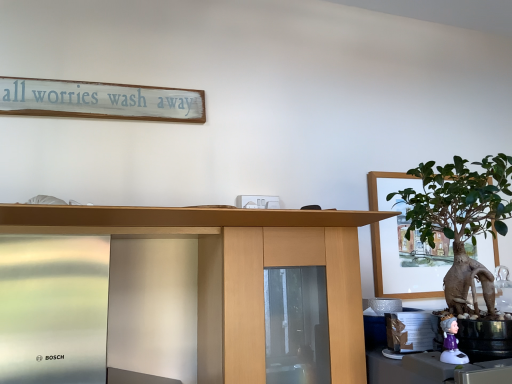
What do you see at coordinates (462, 220) in the screenshot? I see `green matte houseplant at right` at bounding box center [462, 220].

This screenshot has width=512, height=384. I want to click on white plastic figurine at lower right, so click(451, 343).

Does point (457, 345) appear closer or farther from the camera than point (477, 207)?

Point (457, 345).

From the image's perspective, is white plastic figurine at lower right over green matte houseplant at right?

No.

Is white plastic figurine at lower right at the right side of green matte houseplant at right?

No.

Consider the image. Which of these two, white plastic figurine at lower right or green matte houseplant at right, stands taller?

Standing taller between the two is green matte houseplant at right.

Who is more distant, green matte houseplant at right or white painted wood signboard at upper center?

white painted wood signboard at upper center is more distant.

From the picture: From a real-world perspective, is green matte houseplant at right located beneath white painted wood signboard at upper center?

Indeed, from a real-world perspective, green matte houseplant at right is positioned beneath white painted wood signboard at upper center.

Which is behind, point (467, 232) or point (14, 88)?

The point (14, 88) is behind.

Is green matte houseplant at right oriented away from white painted wood signboard at upper center?

green matte houseplant at right is not turned away from white painted wood signboard at upper center.

How different are the orientations of white painted wood signboard at upper center and green matte houseplant at right in degrees?

They differ by 0.498 degrees in their facing directions.

Considering the sizes of white painted wood signboard at upper center and green matte houseplant at right in the image, is white painted wood signboard at upper center wider or thinner than green matte houseplant at right?

Considering their sizes, white painted wood signboard at upper center looks slimmer than green matte houseplant at right.

At what (x,y) coordinates should I click in order to perform the action: click on houseplant below the white painted wood signboard at upper center (from the image's perspective). Please return your answer as a coordinate pair (x, y). This screenshot has width=512, height=384. Looking at the image, I should click on (462, 220).

In order to click on desk on the left of the white plastic figurine at lower right in this screenshot , I will do `click(237, 272)`.

Can you confirm if wooden desk at center is shorter than white plastic figurine at lower right?

In fact, wooden desk at center may be taller than white plastic figurine at lower right.

From the image's perspective, which is below, wooden desk at center or white plastic figurine at lower right?

white plastic figurine at lower right, from the image's perspective.

From the picture: Considering the relative positions of wooden desk at center and white plastic figurine at lower right in the image provided, is wooden desk at center to the right of white plastic figurine at lower right from the viewer's perspective?

In fact, wooden desk at center is to the left of white plastic figurine at lower right.

From the image's perspective, is green matte houseplant at right above or below white plastic figurine at lower right?

From the image's perspective, green matte houseplant at right appears above white plastic figurine at lower right.

Does green matte houseplant at right appear on the right side of white plastic figurine at lower right?

Correct, you'll find green matte houseplant at right to the right of white plastic figurine at lower right.

Image resolution: width=512 pixels, height=384 pixels. I want to click on toy that is behind the green matte houseplant at right, so click(x=451, y=343).

Considering the positions of point (448, 181) and point (455, 356), is point (448, 181) closer or farther from the camera than point (455, 356)?

Point (448, 181).

Is green matte houseplant at right closer to camera compared to wooden desk at center?

No, the depth of green matte houseplant at right is greater than that of wooden desk at center.

Which is closer to the camera, [450,204] or [317,243]?

The point [450,204] is in front.

Does green matte houseplant at right have a lesser height compared to wooden desk at center?

Correct, green matte houseplant at right is not as tall as wooden desk at center.

How different are the orientations of wooden desk at center and white painted wood signboard at upper center in degrees?

wooden desk at center and white painted wood signboard at upper center are facing 0.498 degrees away from each other.

Is point (92, 215) farther from camera compared to point (138, 98)?

No.

In the scene shown: From the image's perspective, between wooden desk at center and white painted wood signboard at upper center, who is located below?

wooden desk at center is shown below in the image.

Is wooden desk at center not near white painted wood signboard at upper center?

No.

Locate an element on the screen. houseplant above the white plastic figurine at lower right (from the image's perspective) is located at coordinates (462, 220).

This screenshot has width=512, height=384. Find the location of `bulletin board that is above the green matte houseplant at right (from a real-world perspective)`. bulletin board that is above the green matte houseplant at right (from a real-world perspective) is located at coordinates (99, 100).

When comparing their distances from wooden desk at center, does green matte houseplant at right or white plastic figurine at lower right seem further?

white plastic figurine at lower right is further to wooden desk at center.

Which object lies further to the anchor point green matte houseplant at right, white plastic figurine at lower right or wooden desk at center?

Based on the image, wooden desk at center appears to be further to green matte houseplant at right.

Looking at the image, which one is located closer to wooden desk at center, white painted wood signboard at upper center or green matte houseplant at right?

Based on the image, green matte houseplant at right appears to be nearer to wooden desk at center.

Looking at the image, which one is located closer to wooden desk at center, white plastic figurine at lower right or white painted wood signboard at upper center?

white plastic figurine at lower right.

Looking at this image, estimate the real-world distances between objects in this image. Which object is closer to white painted wood signboard at upper center, wooden desk at center or white plastic figurine at lower right?

The object closer to white painted wood signboard at upper center is wooden desk at center.

Which object lies further to the anchor point white plastic figurine at lower right, wooden desk at center or white painted wood signboard at upper center?

white painted wood signboard at upper center is positioned further to the anchor white plastic figurine at lower right.

Considering their positions, is white plastic figurine at lower right positioned closer to white painted wood signboard at upper center than green matte houseplant at right?

The object closer to white painted wood signboard at upper center is green matte houseplant at right.

Based on their spatial positions, is white painted wood signboard at upper center or white plastic figurine at lower right further from green matte houseplant at right?

The object further to green matte houseplant at right is white painted wood signboard at upper center.

The height and width of the screenshot is (384, 512). I want to click on desk between white painted wood signboard at upper center and green matte houseplant at right, so click(237, 272).

What are the coordinates of `toy between wooden desk at center and green matte houseplant at right in the horizontal direction` in the screenshot? It's located at (451, 343).

Identify the location of toy between white painted wood signboard at upper center and green matte houseplant at right in the horizontal direction. Image resolution: width=512 pixels, height=384 pixels. (451, 343).

This screenshot has height=384, width=512. Find the location of `desk between white painted wood signboard at upper center and white plastic figurine at lower right from left to right`. desk between white painted wood signboard at upper center and white plastic figurine at lower right from left to right is located at coordinates (237, 272).